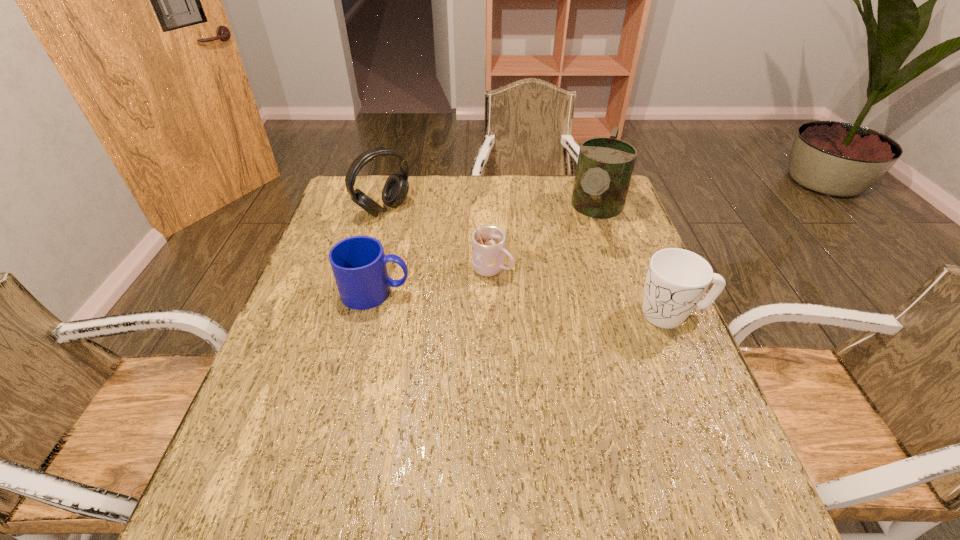
At what (x,y) coordinates should I click in order to perform the action: click on mug situated at the left edge. Please return your answer as a coordinate pair (x, y). Image resolution: width=960 pixels, height=540 pixels. Looking at the image, I should click on (358, 263).

Where is `headset at the left edge`? headset at the left edge is located at coordinates (395, 190).

This screenshot has height=540, width=960. What are the coordinates of `mug that is positioned at the right edge` in the screenshot? It's located at (677, 279).

At what (x,y) coordinates should I click in order to perform the action: click on watering can situated at the right edge. Please return your answer as a coordinate pair (x, y). This screenshot has height=540, width=960. Looking at the image, I should click on (605, 165).

I want to click on object present at the far left corner, so click(395, 190).

This screenshot has height=540, width=960. In order to click on object that is at the far right corner in this screenshot , I will do `click(605, 165)`.

Where is `vacant space at the far edge of the desktop`? vacant space at the far edge of the desktop is located at coordinates (465, 179).

Where is `blank space at the near edge of the desktop`? The height and width of the screenshot is (540, 960). blank space at the near edge of the desktop is located at coordinates (646, 466).

Locate an element on the screen. The height and width of the screenshot is (540, 960). vacant space at the left edge of the desktop is located at coordinates (333, 243).

The height and width of the screenshot is (540, 960). In the image, there is a desktop. In order to click on vacant space at the right edge in this screenshot , I will do `click(614, 222)`.